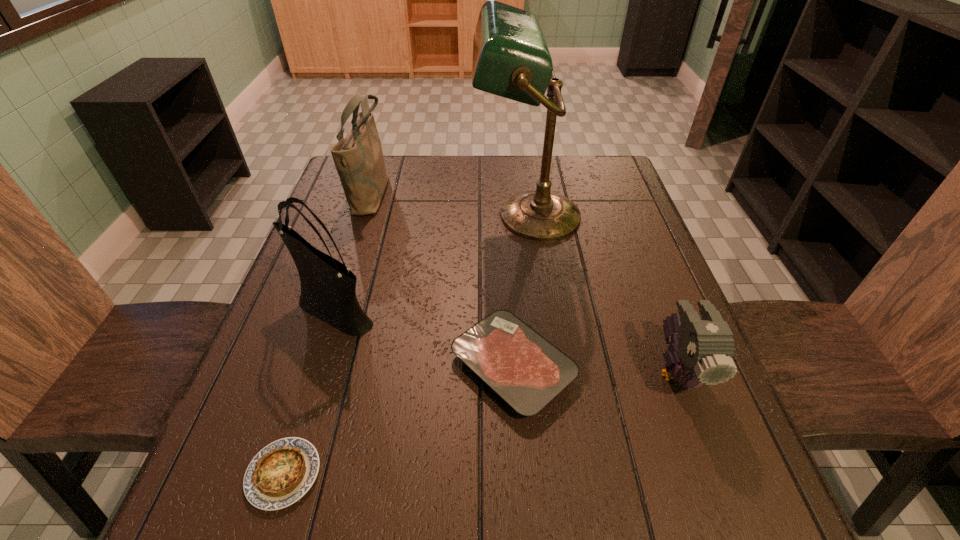
Locate an element on the screen. This screenshot has height=540, width=960. vacant point that satisfies the following two spatial constraints: 1. on the front side of the quiche; 2. on the right side of the nearer shoulder bag is located at coordinates (279, 474).